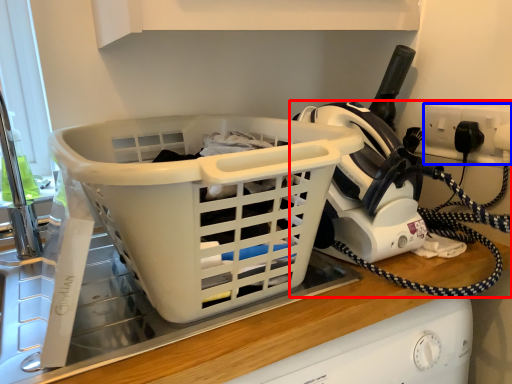
Question: Which object is further to the camera taking this photo, home appliance (highlighted by a red box) or electric outlet (highlighted by a blue box)?

Choices:
 (A) home appliance
 (B) electric outlet

Answer: (B)